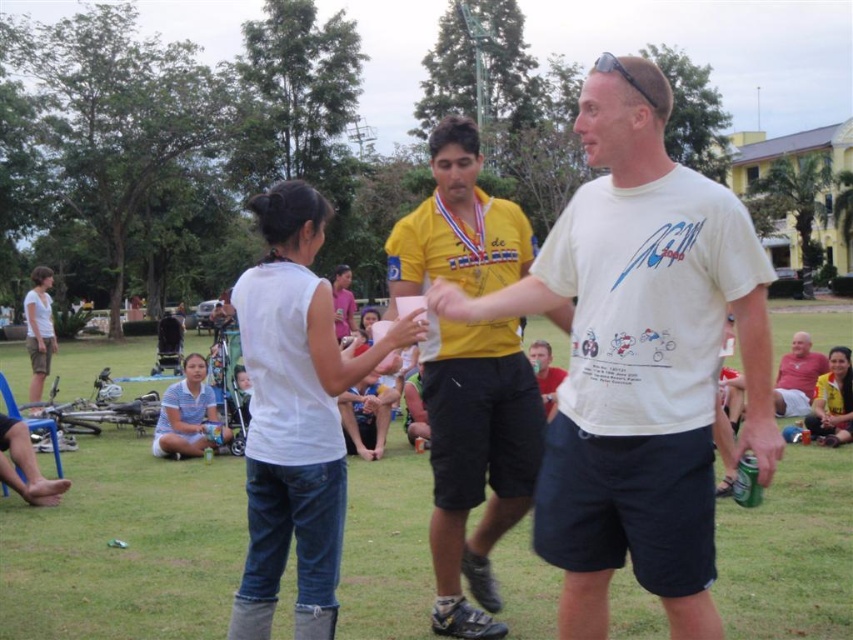
Question: Which object is positioned farthest from the matte red shirt at center?

Choices:
 (A) white cotton t-shirt at center
 (B) yellow matte shirt at center
 (C) white matte shirt at center
 (D) green grass at center

Answer: (A)

Question: Among these points, which one is farthest from the camera?

Choices:
 (A) (614, 444)
 (B) (556, 380)
 (C) (396, 442)
 (D) (515, 253)

Answer: (C)

Question: Is green grass at center below matte red shirt at center?

Choices:
 (A) no
 (B) yes

Answer: (B)

Question: Does white cotton t-shirt at center have a larger size compared to yellow matte shirt at center?

Choices:
 (A) no
 (B) yes

Answer: (A)

Question: Can you confirm if white cotton t-shirt at center is bigger than white matte shirt at center?

Choices:
 (A) yes
 (B) no

Answer: (B)

Question: Among these points, which one is farthest from the camera?

Choices:
 (A) (399, 609)
 (B) (793, 342)
 (C) (451, 202)
 (D) (543, 356)

Answer: (B)